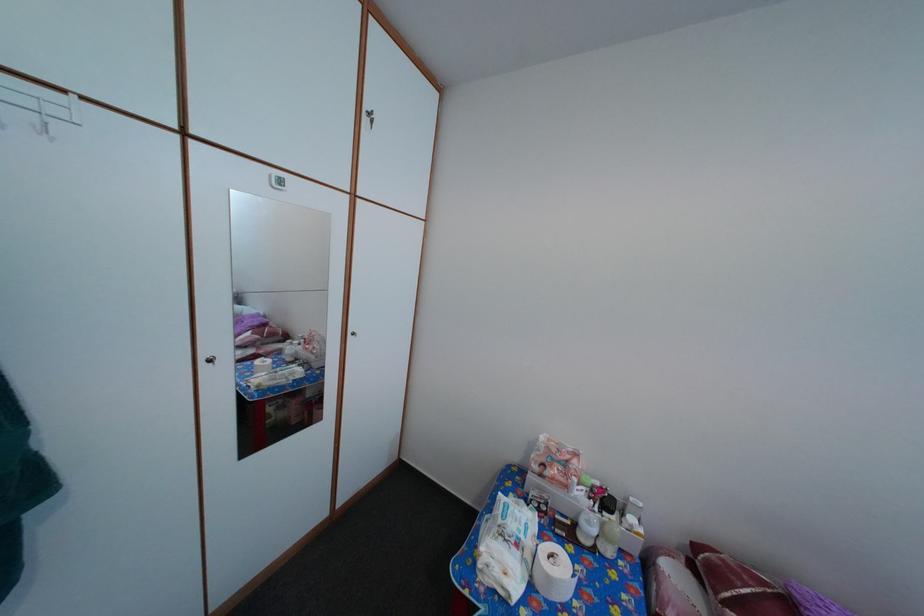
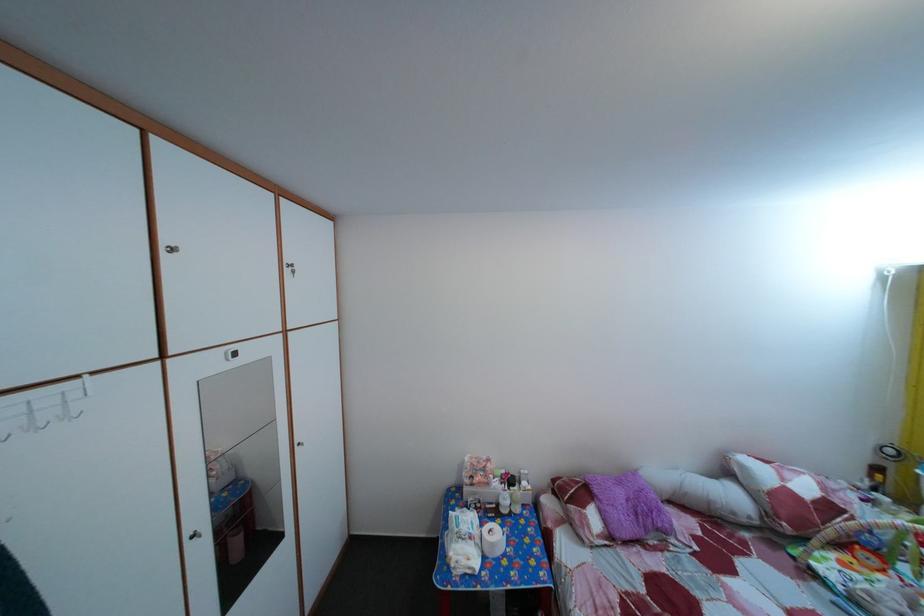
Find the pixel in the second image that matches (623,507) in the first image.

(524, 485)